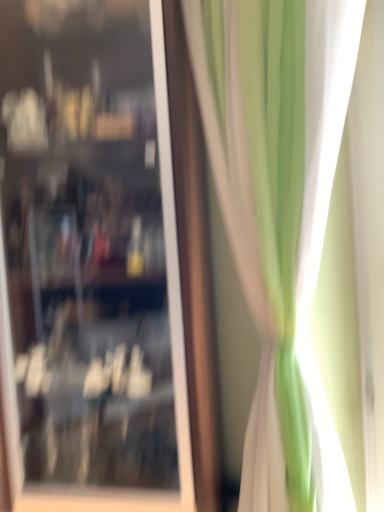
Question: Considering the relative positions of transparent glass cabinet at center and green fabric curtain at right in the image provided, is transparent glass cabinet at center to the left or to the right of green fabric curtain at right?

Choices:
 (A) left
 (B) right

Answer: (A)

Question: Is transparent glass cabinet at center in front of or behind green fabric curtain at right in the image?

Choices:
 (A) front
 (B) behind

Answer: (B)

Question: Considering the positions of point [x=147, y=297] and point [x=306, y=434], is point [x=147, y=297] closer or farther from the camera than point [x=306, y=434]?

Choices:
 (A) farther
 (B) closer

Answer: (A)

Question: Is green fabric curtain at right bigger or smaller than transparent glass cabinet at center?

Choices:
 (A) small
 (B) big

Answer: (A)

Question: In the image, is green fabric curtain at right positioned in front of or behind transparent glass cabinet at center?

Choices:
 (A) front
 (B) behind

Answer: (A)

Question: Is point (306, 423) positioned closer to the camera than point (8, 256)?

Choices:
 (A) closer
 (B) farther

Answer: (A)

Question: From the image's perspective, is green fabric curtain at right positioned above or below transparent glass cabinet at center?

Choices:
 (A) below
 (B) above

Answer: (A)